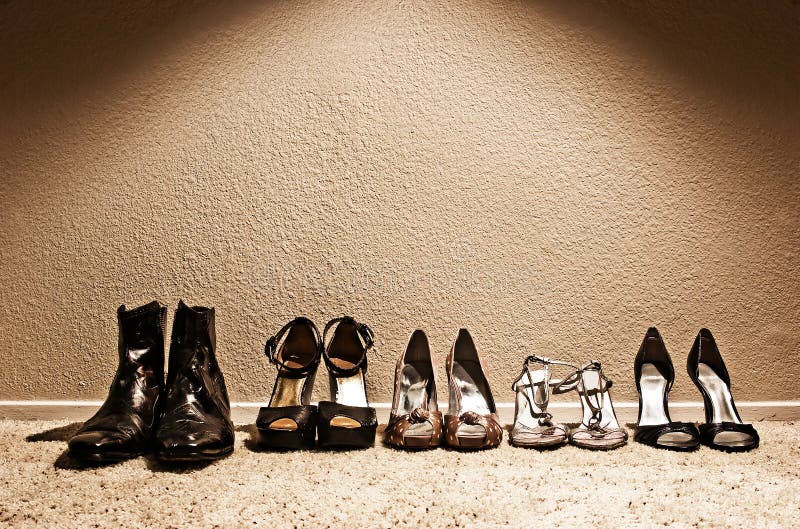
This screenshot has height=529, width=800. What are the coordinates of `pairs of shoes` in the screenshot? It's located at (154, 405), (314, 412), (444, 428), (568, 433), (700, 433).